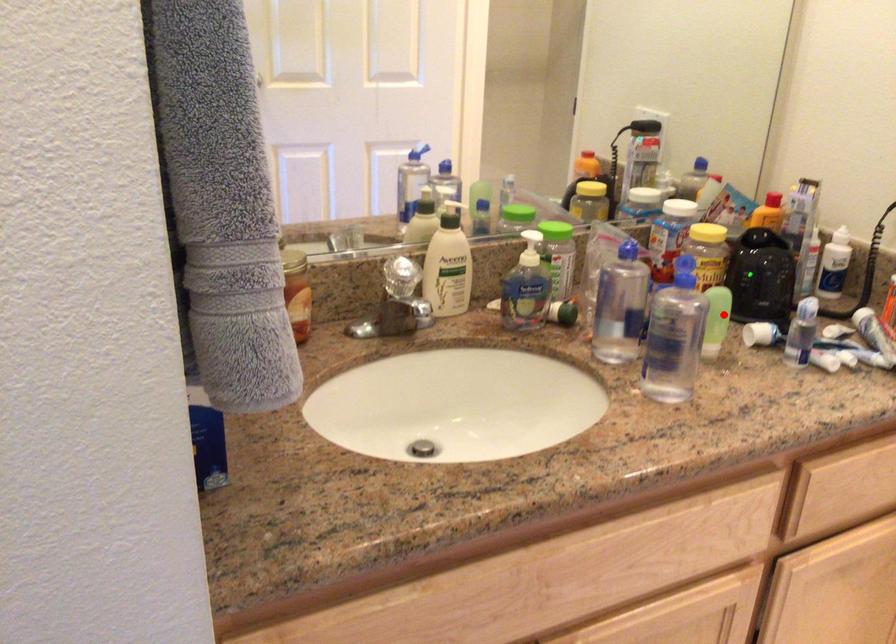
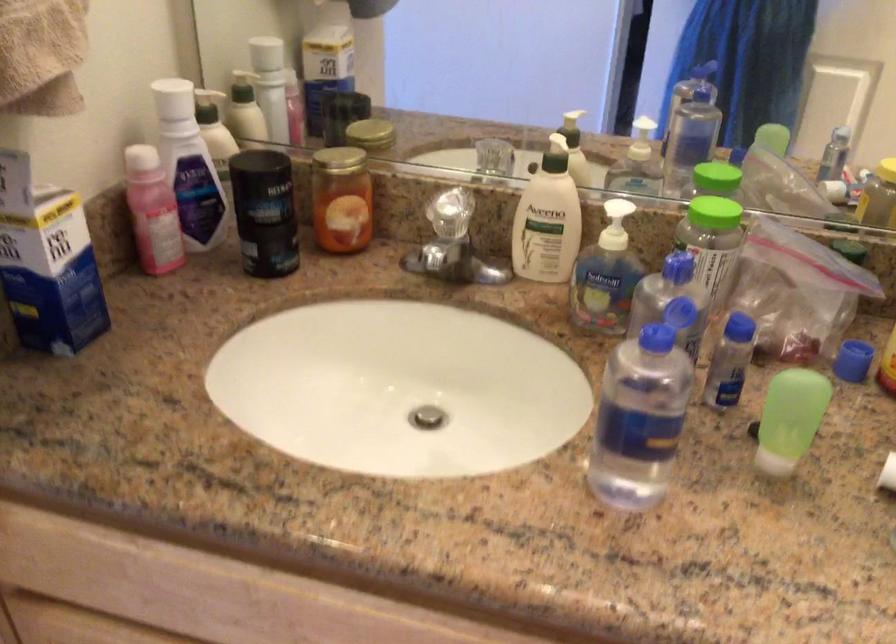
Question: I am providing you with two images of the same scene from different viewpoints. Image1 has a red point marked. In image2, the corresponding 3D location appears at what relative position? Reply with the corresponding letter.

Choices:
 (A) Closer
 (B) Farther

Answer: (A)